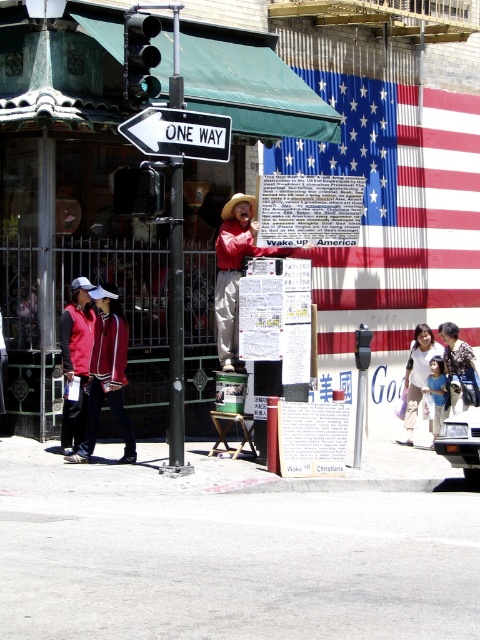
Can you confirm if red jacket at lower left is positioned to the right of matte white shirt at center?

No, red jacket at lower left is not to the right of matte white shirt at center.

Is red jacket at lower left positioned before matte white shirt at center?

Yes, red jacket at lower left is in front of matte white shirt at center.

The height and width of the screenshot is (640, 480). I want to click on red jacket at lower left, so click(107, 374).

Locate an element on the screen. The height and width of the screenshot is (640, 480). red jacket at lower left is located at coordinates (107, 374).

Identify the location of red/white striped flag at upper right. The height and width of the screenshot is (640, 480). (396, 198).

Who is shorter, red/white striped flag at upper right or matte white shirt at center?

matte white shirt at center is shorter.

Is point (429, 296) positioned after point (408, 413)?

Yes, it is.

Where is `red/white striped flag at upper right`? The width and height of the screenshot is (480, 640). red/white striped flag at upper right is located at coordinates tap(396, 198).

Is red jacket at lower left bigger than reddish-orange shirt at center?

Incorrect, red jacket at lower left is not larger than reddish-orange shirt at center.

Which of these two, red jacket at lower left or reddish-orange shirt at center, stands taller?

With more height is reddish-orange shirt at center.

Where is `red jacket at lower left`? red jacket at lower left is located at coordinates pyautogui.click(x=107, y=374).

Where is `red jacket at lower left`? red jacket at lower left is located at coordinates (107, 374).